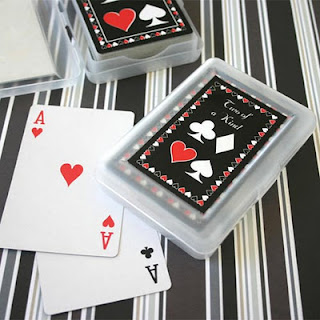
Where is `playing cards`? This screenshot has width=320, height=320. playing cards is located at coordinates (83, 198), (81, 267).